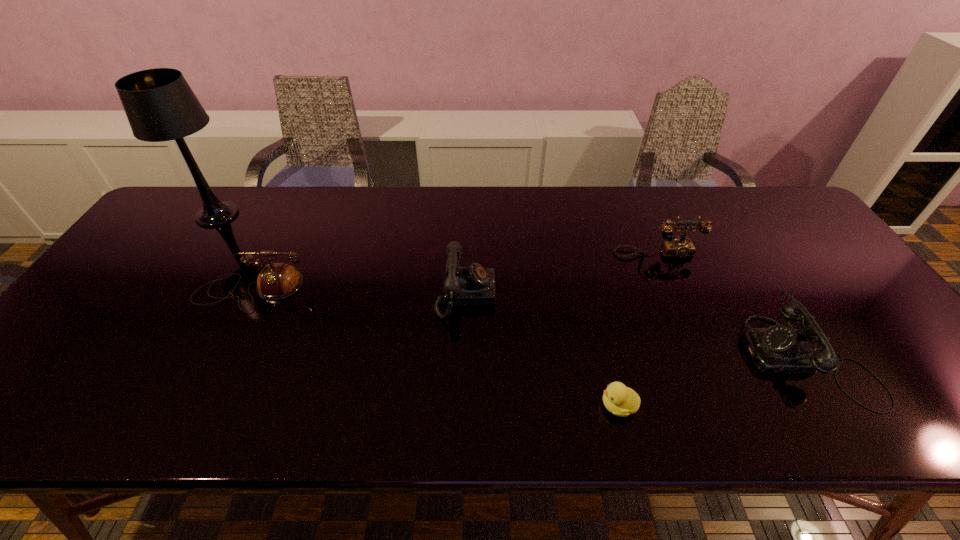
The image size is (960, 540). I want to click on the tallest object, so click(x=160, y=106).

The image size is (960, 540). I want to click on table lamp, so click(x=160, y=106).

Identify the location of the second telephone from left to right. The width and height of the screenshot is (960, 540). (475, 285).

In order to click on the farthest telephone in this screenshot , I will do `click(680, 247)`.

Find the location of a particular element. This screenshot has width=960, height=540. the leftmost telephone is located at coordinates (277, 280).

Find the location of `the third object from right to left`. the third object from right to left is located at coordinates (618, 399).

You are a GUI agent. You are given a task and a screenshot of the screen. Output one action in this format:
    pyautogui.click(x=<x>, y=<y>)
    Task: Click on the shortest object
    This screenshot has width=960, height=540.
    Given the screenshot: What is the action you would take?
    pyautogui.click(x=618, y=399)

Find the location of a particular element. Image resolution: width=960 pixels, height=540 pixels. blank space located on the front of the tallest object is located at coordinates (172, 280).

The height and width of the screenshot is (540, 960). I want to click on vacant space located 0.080m on the dial of the second telephone from left to right, so click(526, 295).

Locate an element on the screen. This screenshot has height=540, width=960. vacant space located 0.080m on the front-facing side of the second farthest object is located at coordinates (669, 280).